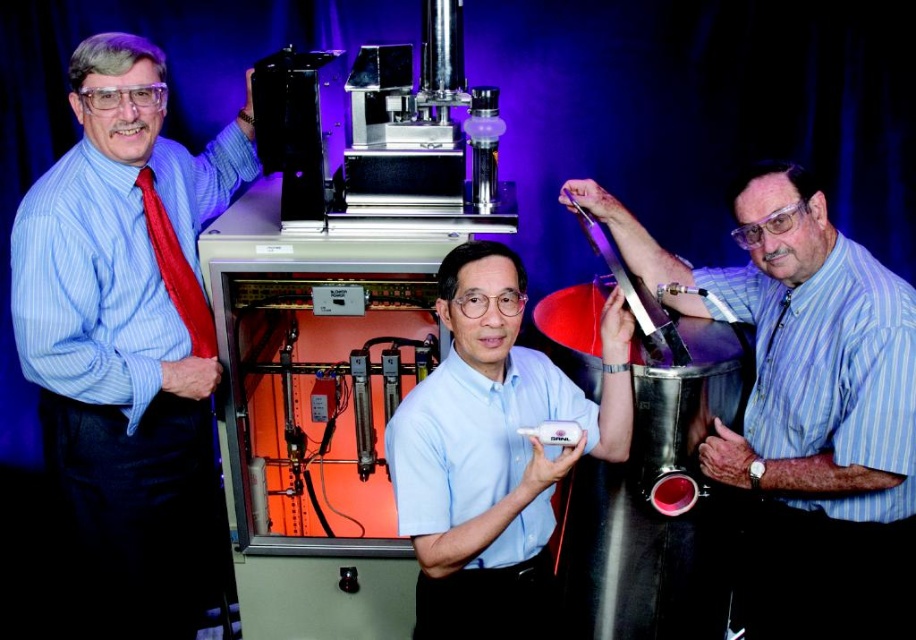
You are an engineer in a lab and need to determine which object is taller between the white plastic remote at center and the red silk tie at left. Based on the scene, which one is taller?

The white plastic remote at center is taller than the red silk tie at left according to the description.

You are a technician in a lab and need to reach the white plastic remote at center from your current position near the matte blue shirt at right. Can you estimate if you can comfortably reach it without moving your feet?

The matte blue shirt at right is 51.58 centimeters away from the white plastic remote at center. Since the average human arm span is about 45 cm, you would need to move slightly closer to reach it comfortably.

You are a technician in a lab who needs to reach the white plastic remote at center from the blue striped shirt at left. Can you comfortably reach it without moving your feet?

The distance between the blue striped shirt at left and the white plastic remote at center is 85.74 centimeters. Since this distance is greater than the typical comfortable reaching distance of about 70 centimeters, you would likely need to move your feet to reach it comfortably.